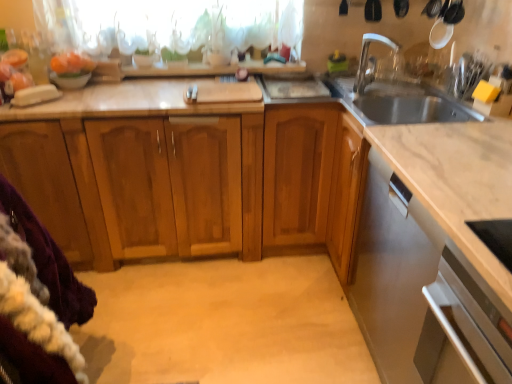
Question: Looking at the image, does purple fleece blanket at lower left seem bigger or smaller compared to orange matte bowl at upper left?

Choices:
 (A) big
 (B) small

Answer: (A)

Question: Visually, is purple fleece blanket at lower left positioned to the left or to the right of orange matte bowl at upper left?

Choices:
 (A) left
 (B) right

Answer: (B)

Question: Which is farther from the orange matte bowl at upper left?

Choices:
 (A) satin silver oven at lower right
 (B) white glossy bowl at upper left
 (C) satin silver dishwasher at lower right
 (D) purple fleece blanket at lower left
 (E) wooden cabinets at center

Answer: (A)

Question: Which object is positioned farthest from the translucent fabric at upper center?

Choices:
 (A) purple fleece blanket at lower left
 (B) orange matte bowl at upper left
 (C) white glossy faucet at upper right
 (D) satin silver oven at lower right
 (E) wooden cabinets at center

Answer: (D)